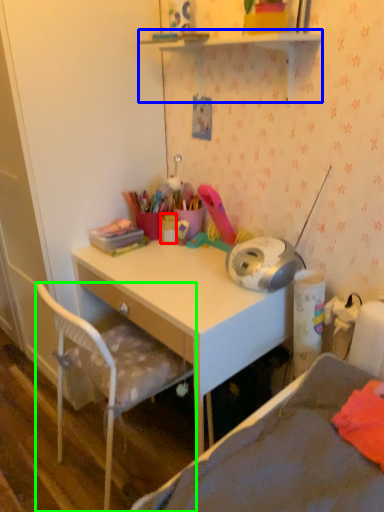
Question: Based on their relative distances, which object is farther from stationery (highlighted by a red box)? Choose from shelf (highlighted by a blue box) and chair (highlighted by a green box).

Choices:
 (A) shelf
 (B) chair

Answer: (A)